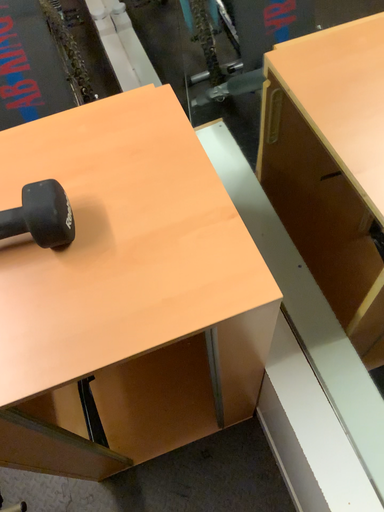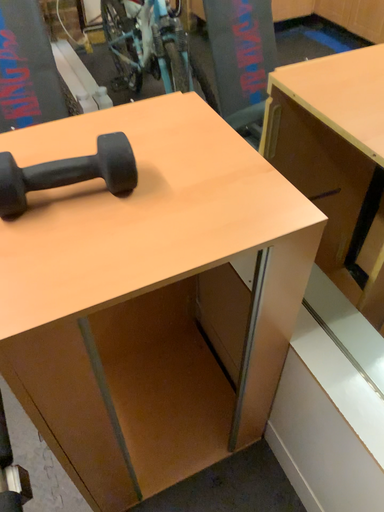
Question: How did the camera likely rotate when shooting the video?

Choices:
 (A) rotated downward
 (B) rotated upward

Answer: (B)